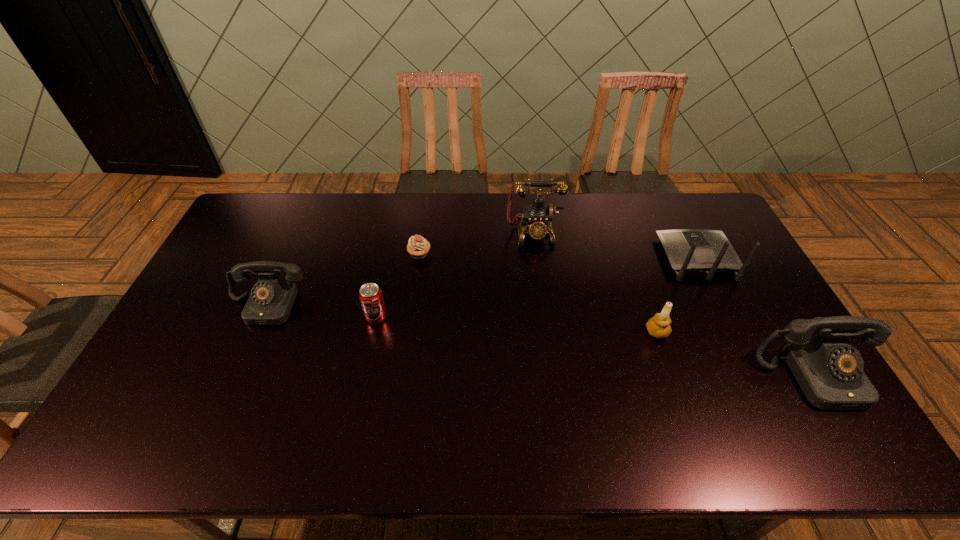
The image size is (960, 540). I want to click on object situated at the near edge, so click(x=829, y=370).

Locate an element on the screen. Image resolution: width=960 pixels, height=540 pixels. object positioned at the left edge is located at coordinates (271, 299).

The width and height of the screenshot is (960, 540). Find the location of `telephone at the right edge`. telephone at the right edge is located at coordinates pyautogui.click(x=829, y=370).

I want to click on router situated at the right edge, so click(692, 251).

Find the location of `object present at the near right corner`. object present at the near right corner is located at coordinates (829, 370).

You are a GUI agent. You are given a task and a screenshot of the screen. Output one action in this format:
    pyautogui.click(x=<x>, y=<y>)
    Task: Click on the free space at the far edge of the desktop
    
    Given the screenshot: What is the action you would take?
    pyautogui.click(x=560, y=220)

In the image, there is a desktop. Where is `vacant space at the near edge`? Image resolution: width=960 pixels, height=540 pixels. vacant space at the near edge is located at coordinates pos(646,402).

Locate an element on the screen. The width and height of the screenshot is (960, 540). vacant space at the left edge of the desktop is located at coordinates (204, 307).

Locate an element on the screen. Image resolution: width=960 pixels, height=540 pixels. free space at the right edge is located at coordinates (734, 299).

At what (x,y) coordinates should I click in order to perform the action: click on free region at the near left corner. Please return your answer as a coordinate pair (x, y). Looking at the image, I should click on (135, 393).